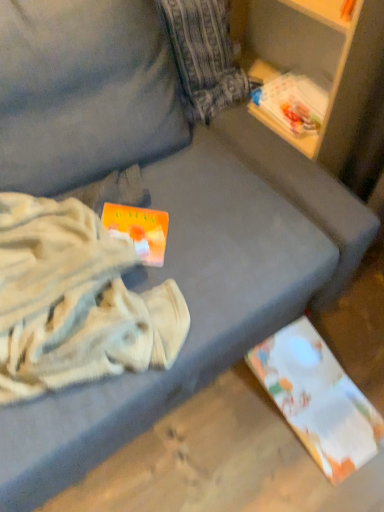
Question: Is white paper at lower right, which appears as the 2th paperback book when viewed from the front, at the left side of orange matte paperback book at center-left, acting as the 1th paperback book starting from the left?

Choices:
 (A) yes
 (B) no

Answer: (B)

Question: Is white paper at lower right, which appears as the 2th paperback book when viewed from the front, facing towards orange matte paperback book at center-left, the 2th paperback book viewed from the right?

Choices:
 (A) yes
 (B) no

Answer: (B)

Question: Does white paper at lower right, arranged as the 2th paperback book when viewed from the left, lie in front of orange matte paperback book at center-left, acting as the 1th paperback book starting from the left?

Choices:
 (A) yes
 (B) no

Answer: (B)

Question: From a real-world perspective, is white paper at lower right, acting as the first paperback book starting from the back, on orange matte paperback book at center-left, the 2th paperback book viewed from the right?

Choices:
 (A) yes
 (B) no

Answer: (B)

Question: Can you confirm if white paper at lower right, the second paperback book from the top, is positioned to the right of orange matte paperback book at center-left, positioned as the first paperback book in front-to-back order?

Choices:
 (A) no
 (B) yes

Answer: (B)

Question: Based on their positions, is orange matte paperback book at center-left, the 2th paperback book viewed from the right, located to the left or right of white paper at lower right, marked as the first paperback book in a bottom-to-top arrangement?

Choices:
 (A) left
 (B) right

Answer: (A)

Question: From a real-world perspective, relative to white paper at lower right, the first paperback book when ordered from right to left, is orange matte paperback book at center-left, positioned as the first paperback book in front-to-back order, vertically above or below?

Choices:
 (A) above
 (B) below

Answer: (A)

Question: Considering the positions of point (165, 234) and point (352, 404), is point (165, 234) closer or farther from the camera than point (352, 404)?

Choices:
 (A) farther
 (B) closer

Answer: (B)

Question: From the image's perspective, is orange matte paperback book at center-left, acting as the 2th paperback book starting from the back, above or below white paper at lower right, marked as the first paperback book in a bottom-to-top arrangement?

Choices:
 (A) below
 (B) above

Answer: (B)

Question: Considering their positions, is white paper at lower right, the first paperback book when ordered from right to left, located in front of or behind white cotton blanket at left?

Choices:
 (A) behind
 (B) front

Answer: (A)

Question: Is white paper at lower right, which appears as the 2th paperback book when viewed from the front, to the left or to the right of white cotton blanket at left in the image?

Choices:
 (A) left
 (B) right

Answer: (B)

Question: From their relative heights in the image, would you say white paper at lower right, arranged as the 2th paperback book when viewed from the left, is taller or shorter than white cotton blanket at left?

Choices:
 (A) tall
 (B) short

Answer: (B)

Question: Considering the positions of white paper at lower right, marked as the first paperback book in a bottom-to-top arrangement, and white cotton blanket at left in the image, is white paper at lower right, marked as the first paperback book in a bottom-to-top arrangement, wider or thinner than white cotton blanket at left?

Choices:
 (A) wide
 (B) thin

Answer: (B)

Question: Relative to white cotton blanket at left, is orange matte paperback book at center-left, arranged as the 2th paperback book when ordered from the bottom, in front or behind?

Choices:
 (A) front
 (B) behind

Answer: (B)

Question: Is orange matte paperback book at center-left, acting as the 2th paperback book starting from the back, taller or shorter than white cotton blanket at left?

Choices:
 (A) tall
 (B) short

Answer: (B)